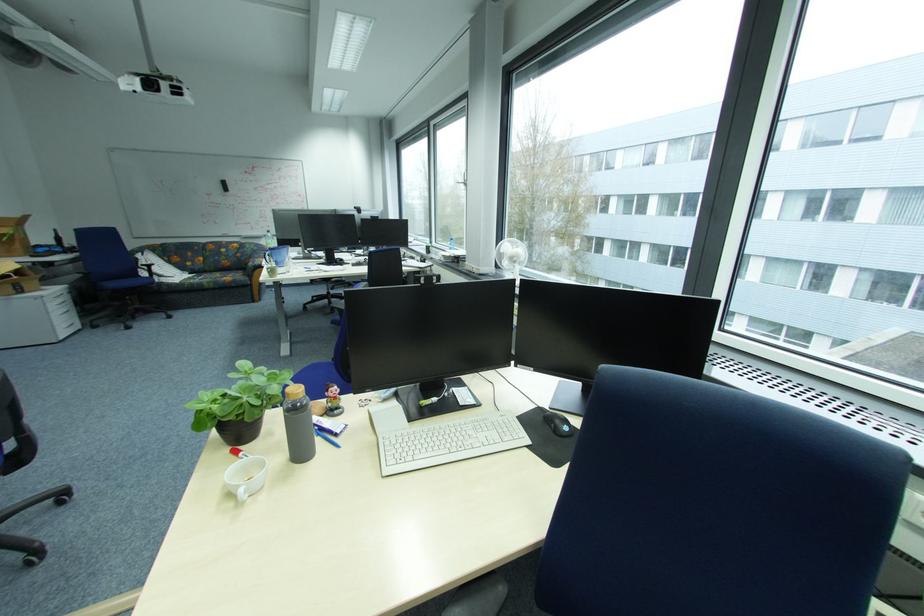
This screenshot has width=924, height=616. What do you see at coordinates (223, 278) in the screenshot?
I see `a floral sofa sitting surface` at bounding box center [223, 278].